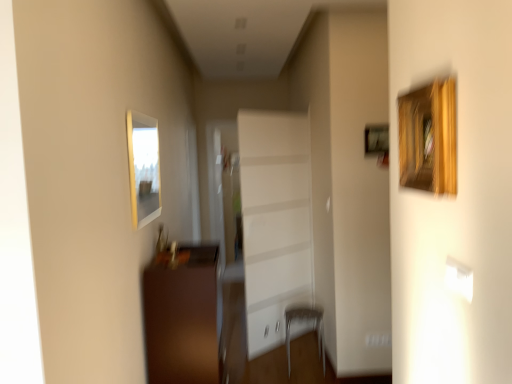
Question: Does brown wooden cabinet at lower left have a lesser height compared to metallic silver armchair at lower center?

Choices:
 (A) yes
 (B) no

Answer: (B)

Question: Are brown wooden cabinet at lower left and metallic silver armchair at lower center beside each other?

Choices:
 (A) no
 (B) yes

Answer: (A)

Question: Considering the relative sizes of brown wooden cabinet at lower left and metallic silver armchair at lower center in the image provided, is brown wooden cabinet at lower left bigger than metallic silver armchair at lower center?

Choices:
 (A) yes
 (B) no

Answer: (A)

Question: From the image's perspective, would you say brown wooden cabinet at lower left is shown under metallic silver armchair at lower center?

Choices:
 (A) yes
 (B) no

Answer: (B)

Question: Is brown wooden cabinet at lower left taller than metallic silver armchair at lower center?

Choices:
 (A) no
 (B) yes

Answer: (B)

Question: From the image's perspective, relative to white glossy cabinet at center, is metallic silver armchair at lower center above or below?

Choices:
 (A) below
 (B) above

Answer: (A)

Question: Is metallic silver armchair at lower center in front of or behind white glossy cabinet at center in the image?

Choices:
 (A) front
 (B) behind

Answer: (A)

Question: In terms of size, does metallic silver armchair at lower center appear bigger or smaller than white glossy cabinet at center?

Choices:
 (A) small
 (B) big

Answer: (A)

Question: From a real-world perspective, is metallic silver armchair at lower center positioned above or below white glossy cabinet at center?

Choices:
 (A) above
 (B) below

Answer: (B)

Question: From the image's perspective, is metallic silver armchair at lower center located above or below brown wooden cabinet at lower left?

Choices:
 (A) above
 (B) below

Answer: (B)

Question: Considering their positions, is metallic silver armchair at lower center located in front of or behind brown wooden cabinet at lower left?

Choices:
 (A) front
 (B) behind

Answer: (B)

Question: Does point pos(320,321) appear closer or farther from the camera than point pos(199,274)?

Choices:
 (A) farther
 (B) closer

Answer: (A)

Question: Is metallic silver armchair at lower center spatially inside brown wooden cabinet at lower left, or outside of it?

Choices:
 (A) inside
 (B) outside

Answer: (B)

Question: Do you think brown wooden cabinet at lower left is within metallic silver armchair at lower center, or outside of it?

Choices:
 (A) inside
 (B) outside

Answer: (B)

Question: Considering the positions of brown wooden cabinet at lower left and metallic silver armchair at lower center in the image, is brown wooden cabinet at lower left bigger or smaller than metallic silver armchair at lower center?

Choices:
 (A) big
 (B) small

Answer: (A)